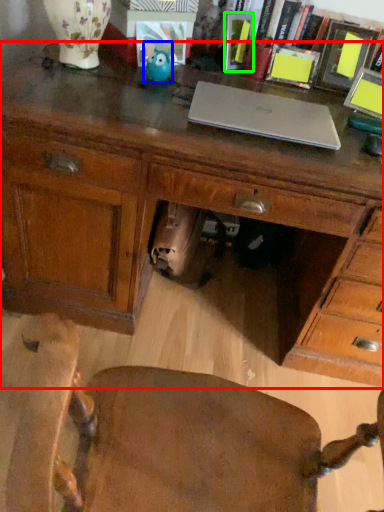
Question: Which object is the closest to the desk (highlighted by a red box)? Choose among these: toy (highlighted by a blue box) or book (highlighted by a green box).

Choices:
 (A) toy
 (B) book

Answer: (A)